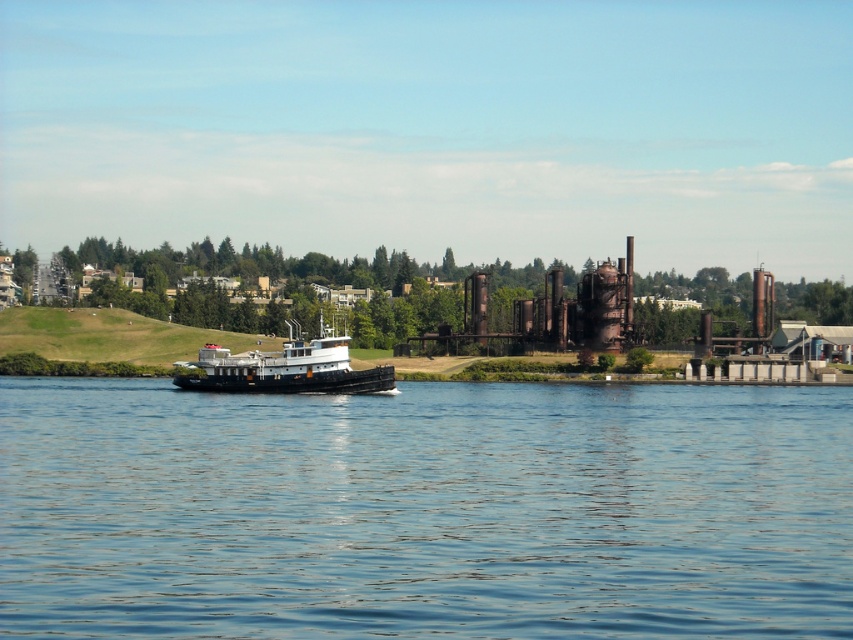
You are a photographer planning to capture the blue water at center and the black matte tugboat at center in a single shot. Based on their sizes in the image, which object should you focus on first to ensure both are in frame?

The blue water at center has a smaller size compared to the black matte tugboat at center, so you should focus on the black matte tugboat at center first to ensure both fit in the frame.

You are standing at the point labeled point (498, 524) and want to reach the point labeled point (320, 314). Which direction should you move to get closer to your destination?

You should move away from the camera because point (320, 314) is further from the camera than point (498, 524).

Based on the photo, you are navigating a drone that needs to capture a closeup shot of the blue water at center. According to the coordinates provided, where should the drone focus its camera?

The blue water at center is located at point (424,509), so the drone should focus its camera there to capture the closeup shot.